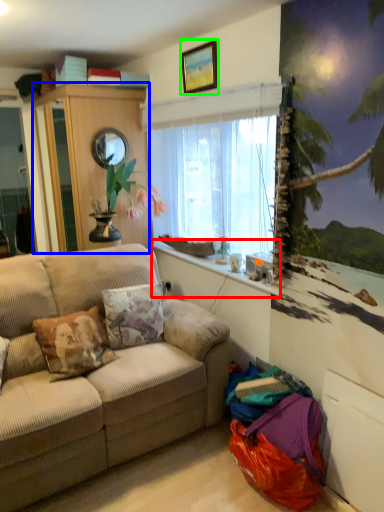
Question: Which object is positioned closest to window sill (highlighted by a red box)? Select from cabinetry (highlighted by a blue box) and picture frame (highlighted by a green box).

Choices:
 (A) cabinetry
 (B) picture frame

Answer: (A)